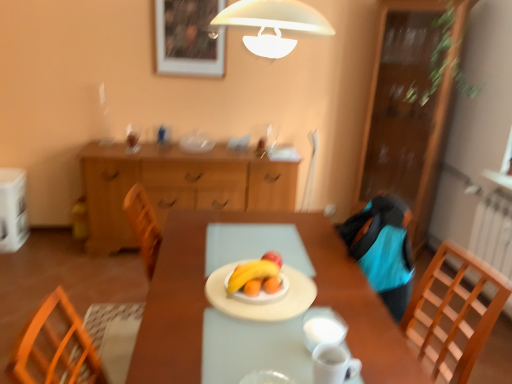
Locate an element on the screen. This screenshot has width=512, height=384. vacant space in between white glossy mug at lower center, the 3th tableware viewed from the back, and white matte plate at center, which is the fourth tableware in front-to-back order is located at coordinates (269, 343).